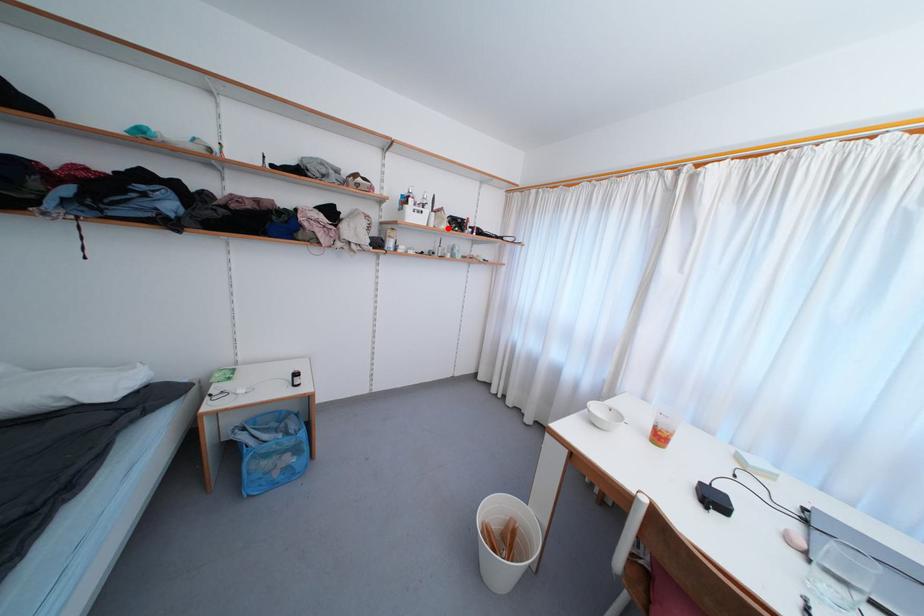
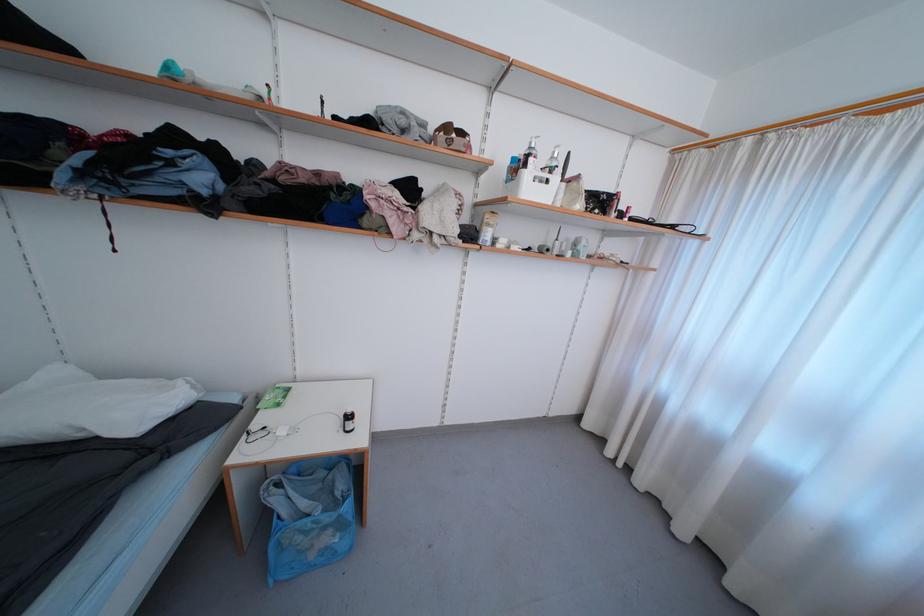
The point at the highlighted location is marked in the first image. Where is the corresponding point in the second image?

(584, 208)